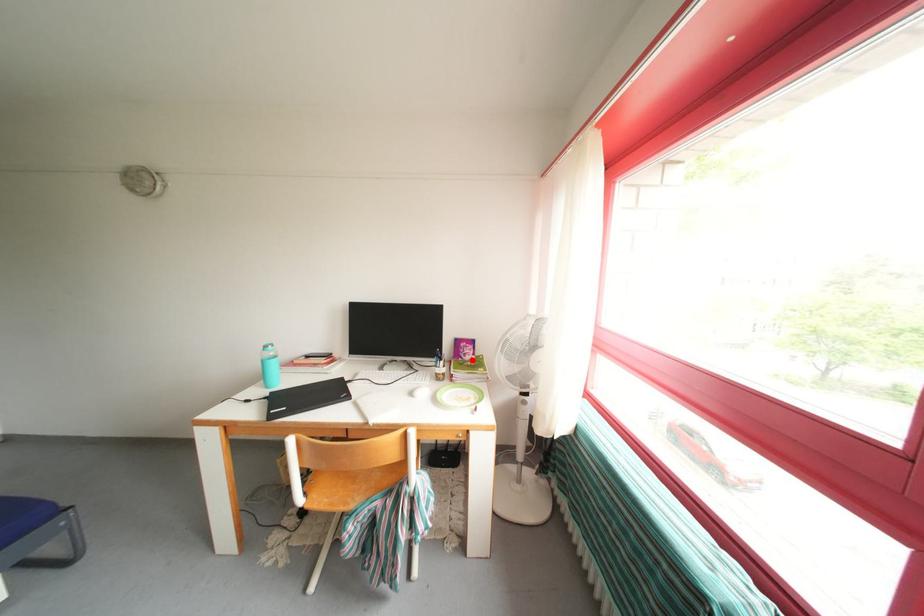
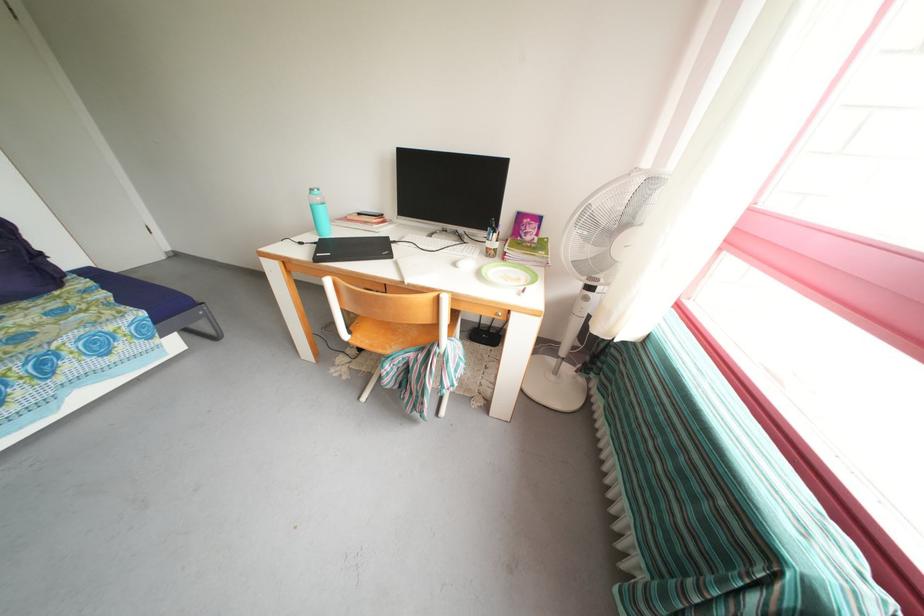
Where in the second image is the point corresponding to the highlighted location from the first image?

(532, 238)